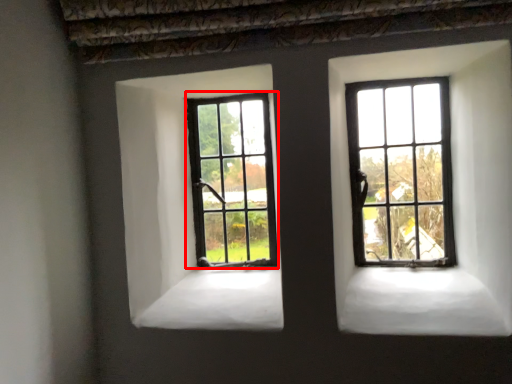
Question: From the image's perspective, where is window (annotated by the red box) located relative to window?

Choices:
 (A) above
 (B) below

Answer: (B)